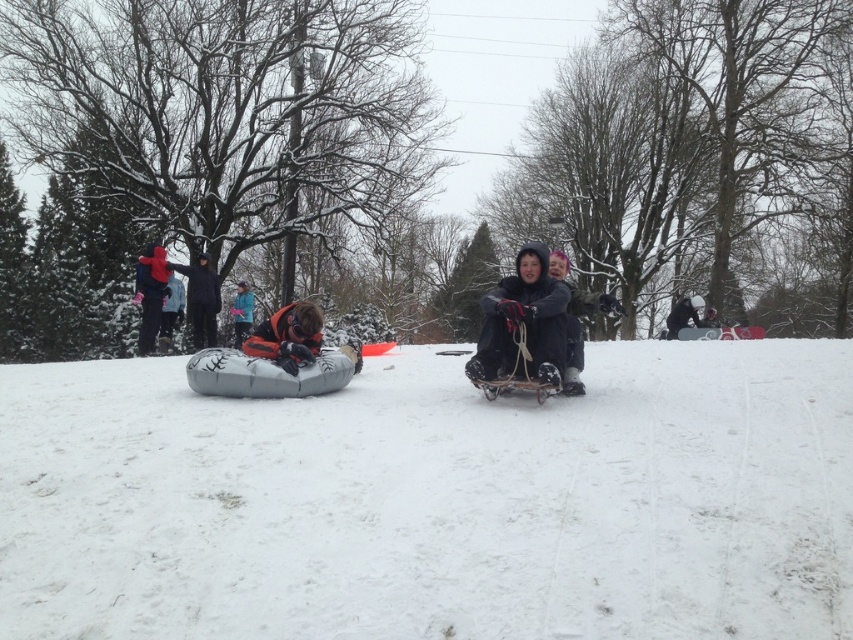
Question: Does white fluffy snow at upper left come in front of blue fleece jacket at center?

Choices:
 (A) yes
 (B) no

Answer: (A)

Question: Considering the real-world distances, which object is farthest from the orange fleece jacket at center?

Choices:
 (A) white fluffy snow at upper left
 (B) white fluffy snow at center

Answer: (A)

Question: Can you confirm if red fleece jacket at upper left is wider than white fluffy snow at upper left?

Choices:
 (A) yes
 (B) no

Answer: (A)

Question: In this image, where is dark gray fabric sled at center located relative to orange fleece jacket at center?

Choices:
 (A) left
 (B) right

Answer: (B)

Question: Which of these objects is positioned farthest from the orange fleece jacket at center?

Choices:
 (A) dark gray fabric jacket at center
 (B) white fluffy snow at upper left

Answer: (A)

Question: Which point is closer to the camera?

Choices:
 (A) (152, 333)
 (B) (672, 330)
 (C) (194, 342)

Answer: (A)